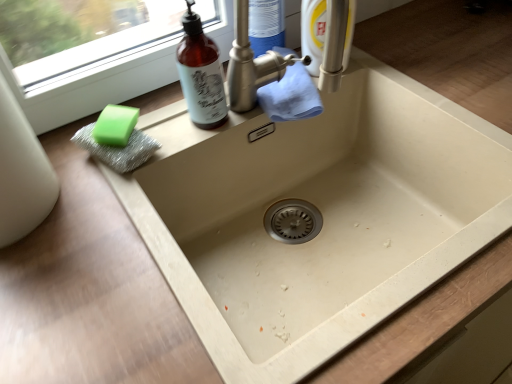
Question: Can you confirm if green sponge at left is shorter than brown glass bottle at upper left?

Choices:
 (A) yes
 (B) no

Answer: (A)

Question: From a real-world perspective, is green sponge at left physically below brown glass bottle at upper left?

Choices:
 (A) no
 (B) yes

Answer: (B)

Question: Is the depth of green sponge at left less than that of brown glass bottle at upper left?

Choices:
 (A) yes
 (B) no

Answer: (B)

Question: From the image's perspective, is green sponge at left on top of brown glass bottle at upper left?

Choices:
 (A) yes
 (B) no

Answer: (B)

Question: Is green sponge at left in contact with brown glass bottle at upper left?

Choices:
 (A) yes
 (B) no

Answer: (B)

Question: Is green sponge at left aimed at brown glass bottle at upper left?

Choices:
 (A) no
 (B) yes

Answer: (A)

Question: Considering the relative sizes of brown glass bottle at upper left and green sponge at left in the image provided, is brown glass bottle at upper left thinner than green sponge at left?

Choices:
 (A) no
 (B) yes

Answer: (B)

Question: Can we say brown glass bottle at upper left lies outside green sponge at left?

Choices:
 (A) no
 (B) yes

Answer: (B)

Question: Does brown glass bottle at upper left lie in front of green sponge at left?

Choices:
 (A) yes
 (B) no

Answer: (A)

Question: Is brown glass bottle at upper left at the left side of green sponge at left?

Choices:
 (A) yes
 (B) no

Answer: (B)

Question: From a real-world perspective, is brown glass bottle at upper left physically below green sponge at left?

Choices:
 (A) yes
 (B) no

Answer: (B)

Question: Could you tell me if brown glass bottle at upper left is turned towards green sponge at left?

Choices:
 (A) no
 (B) yes

Answer: (A)

Question: From a real-world perspective, is green sponge at left above or below brown glass bottle at upper left?

Choices:
 (A) above
 (B) below

Answer: (B)